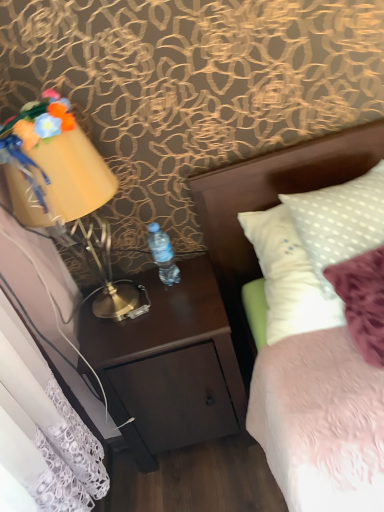
Locate an element on the screen. This screenshot has height=512, width=384. free space between matte yellow lampshade at left and clear plastic bottle at center is located at coordinates (x=167, y=295).